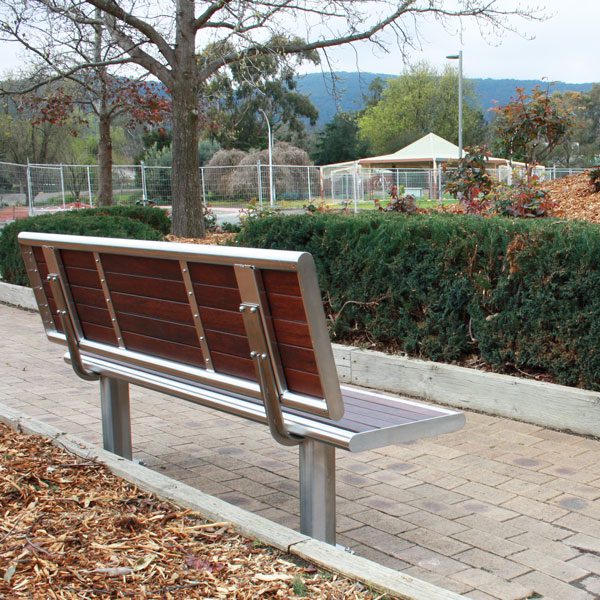
Locate an element on the screen. Image resolution: width=600 pixels, height=600 pixels. seat of chair is located at coordinates (364, 420).